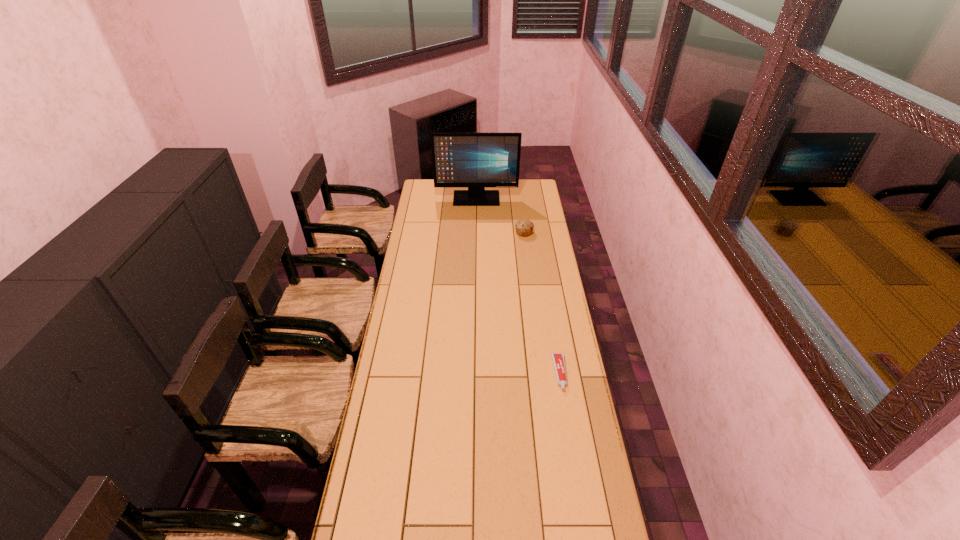
Locate an element on the screen. This screenshot has height=540, width=960. the farthest object is located at coordinates (475, 160).

Locate an element on the screen. This screenshot has height=540, width=960. the tallest object is located at coordinates (475, 160).

You are a GUI agent. You are given a task and a screenshot of the screen. Output one action in this format:
    pyautogui.click(x=<x>, y=<y>)
    Task: Click on the muffin
    
    Given the screenshot: What is the action you would take?
    pyautogui.click(x=524, y=228)

Locate an element on the screen. This screenshot has width=960, height=540. the second farthest object is located at coordinates (524, 228).

Find the location of a particular element. the shortest object is located at coordinates (558, 359).

At what (x,y) coordinates should I click in order to perform the action: click on toothpaste. Please return your answer as a coordinate pair (x, y). Looking at the image, I should click on (558, 359).

Identify the location of vacant area located 0.080m on the screen side of the tallest object. This screenshot has height=540, width=960. (476, 213).

Find the location of `vacant region located 0.090m on the front of the second nearest object`. vacant region located 0.090m on the front of the second nearest object is located at coordinates (526, 248).

I want to click on vacant position located at the nozzle of the toothpaste, so click(x=579, y=488).

At what (x,y) coordinates should I click in order to perform the action: click on object that is at the far edge. Please return your answer as a coordinate pair (x, y). This screenshot has height=540, width=960. Looking at the image, I should click on (475, 160).